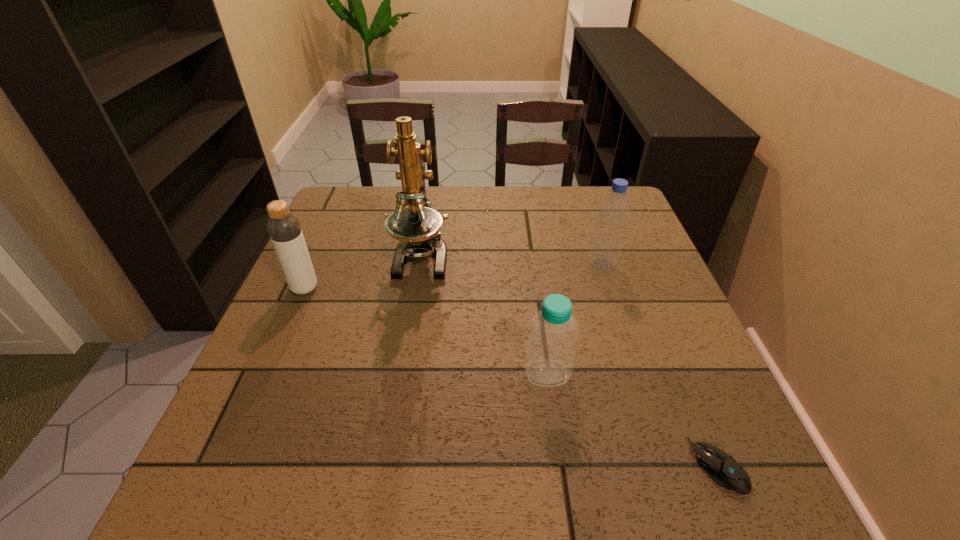
Where is `free space at the far edge of the desktop`? free space at the far edge of the desktop is located at coordinates (508, 198).

What are the coordinates of `free spot at the near edge of the desktop` in the screenshot? It's located at (300, 477).

The image size is (960, 540). In order to click on vacant space at the left edge in this screenshot , I will do pos(326,384).

Locate an element on the screen. The height and width of the screenshot is (540, 960). vacant space at the right edge of the desktop is located at coordinates (649, 322).

Where is `free space at the far left corner`? The height and width of the screenshot is (540, 960). free space at the far left corner is located at coordinates (338, 191).

Image resolution: width=960 pixels, height=540 pixels. Identify the location of free point at the near left corner. (185, 513).

You are a GUI agent. You are given a task and a screenshot of the screen. Output one action in this format:
    pyautogui.click(x=<x>, y=<y>)
    Task: Click on the blank space at the far right corner of the desktop
    The height and width of the screenshot is (540, 960).
    Given the screenshot: What is the action you would take?
    pyautogui.click(x=601, y=196)

Identify the location of free point between the rightmost object and the farthest bottle. This screenshot has height=540, width=960. (660, 366).

The image size is (960, 540). I want to click on vacant space in between the leftmost object and the shortest object, so click(512, 377).

Identify the location of vacant point located between the leftmost bottle and the second bottle from left to right. (425, 331).